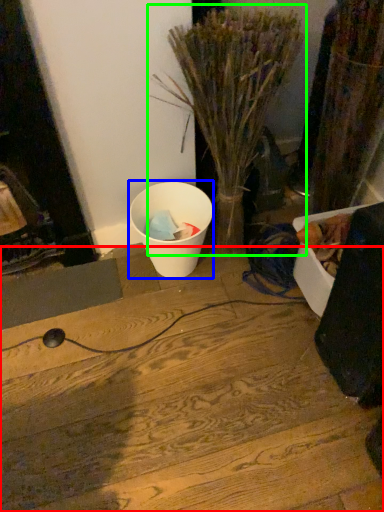
Question: Considering the real-world distances, which object is closest to wood (highlighted by a red box)? waste (highlighted by a blue box) or houseplant (highlighted by a green box).

Choices:
 (A) waste
 (B) houseplant

Answer: (A)